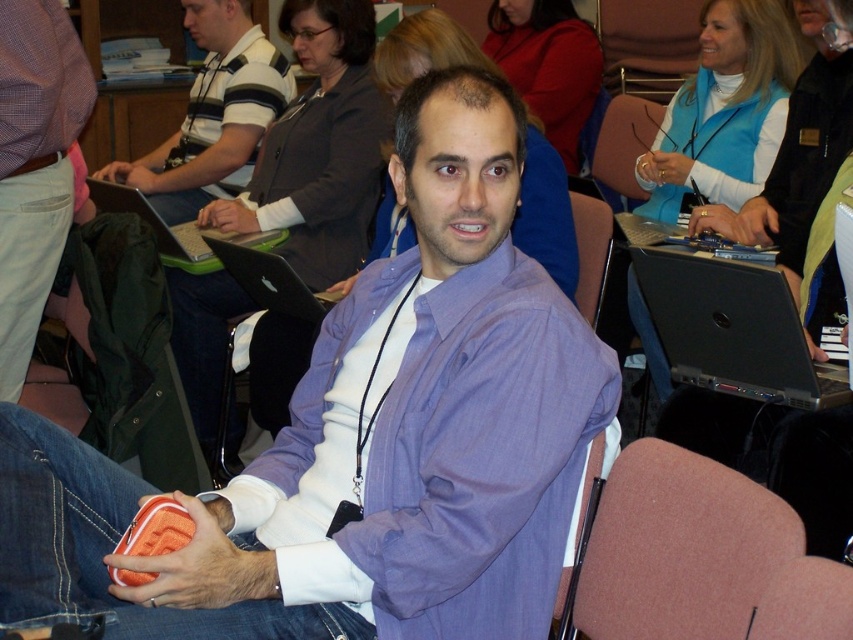
Question: Which object appears closest to the camera in this image?

Choices:
 (A) black glossy laptop at center
 (B) black plastic laptop at center
 (C) purple cotton shirt at center

Answer: (C)

Question: Is striped cotton shirt at center further to camera compared to green plastic laptop at center?

Choices:
 (A) yes
 (B) no

Answer: (A)

Question: Observing the image, what is the correct spatial positioning of brushed metal belt at center in reference to pink fabric chair at upper center?

Choices:
 (A) right
 (B) left

Answer: (B)

Question: Is brown fabric chair at center positioned at the back of black plastic laptop at center?

Choices:
 (A) yes
 (B) no

Answer: (B)

Question: Considering the real-world distances, which object is closest to the brushed metal belt at center?

Choices:
 (A) black plastic laptop at center
 (B) metallic silver laptop at center
 (C) brown fabric chair at center

Answer: (A)

Question: Which of these objects is positioned closest to the black glossy laptop at center?

Choices:
 (A) green plastic laptop at center
 (B) pink fabric chair at upper center
 (C) striped cotton shirt at center

Answer: (A)